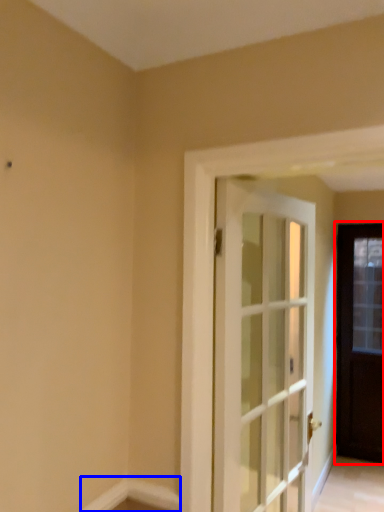
Question: Which object appears closest to the camera in this image, door (highlighted by a red box) or molding (highlighted by a blue box)?

Choices:
 (A) door
 (B) molding

Answer: (B)